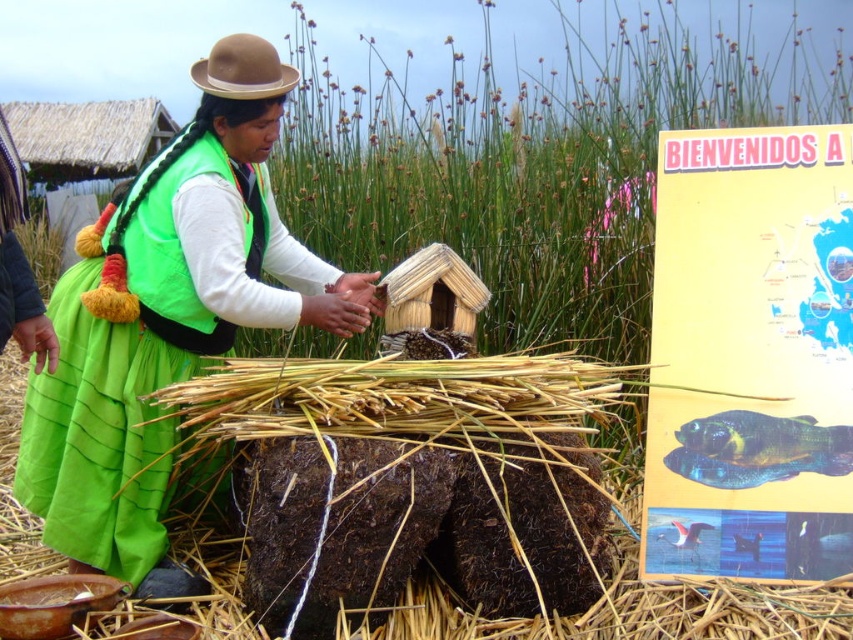
Question: Does green fabric skirt at center have a larger size compared to brown felt hat at upper left?

Choices:
 (A) no
 (B) yes

Answer: (B)

Question: Which point appears farthest from the camera in this image?

Choices:
 (A) (260, 93)
 (B) (781, 401)

Answer: (B)

Question: Can you confirm if yellow paper sign at right is thinner than brown felt hat at upper left?

Choices:
 (A) no
 (B) yes

Answer: (A)

Question: Which point is closer to the camera?

Choices:
 (A) green fabric skirt at center
 (B) yellow paper sign at right
 (C) brown felt hat at upper left

Answer: (A)

Question: Which point appears farthest from the camera in this image?

Choices:
 (A) (277, 65)
 (B) (225, 314)
 (C) (692, 506)

Answer: (A)

Question: Is green fabric skirt at center positioned at the back of brown felt hat at upper left?

Choices:
 (A) no
 (B) yes

Answer: (A)